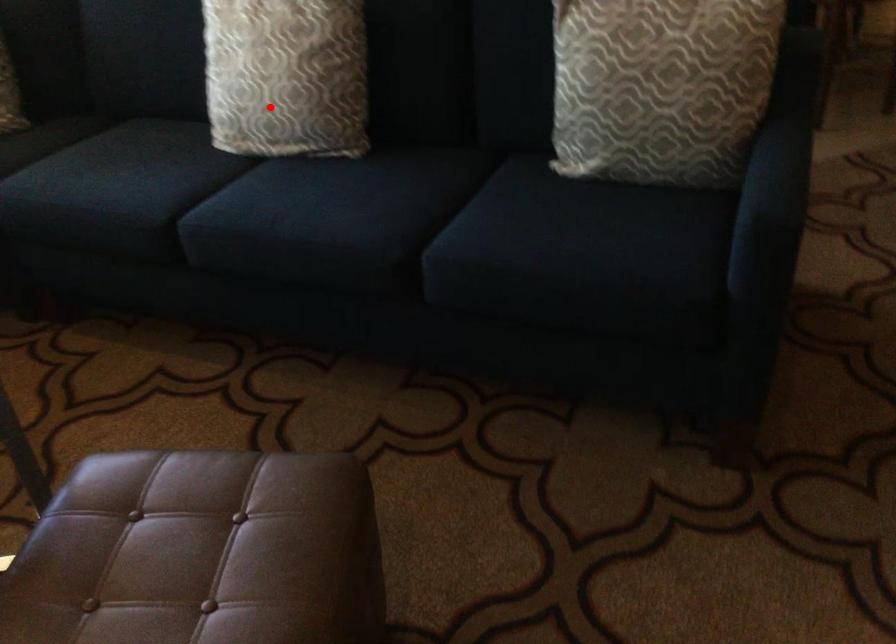
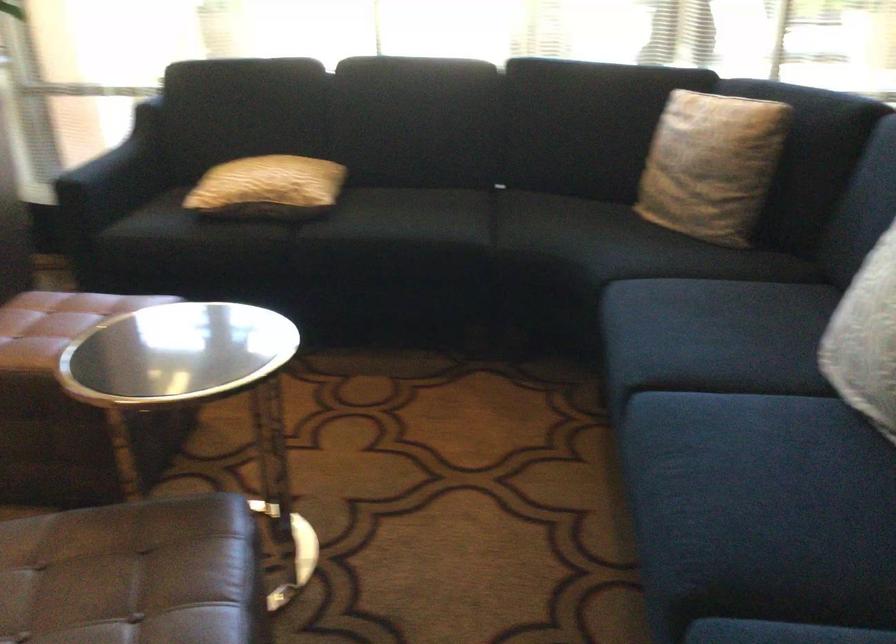
Question: I am providing you with two images of the same scene from different viewpoints. A red point is shown in image1. For the corresponding object point in image2, is it positioned nearer or farther from the camera?

Choices:
 (A) Nearer
 (B) Farther

Answer: (A)